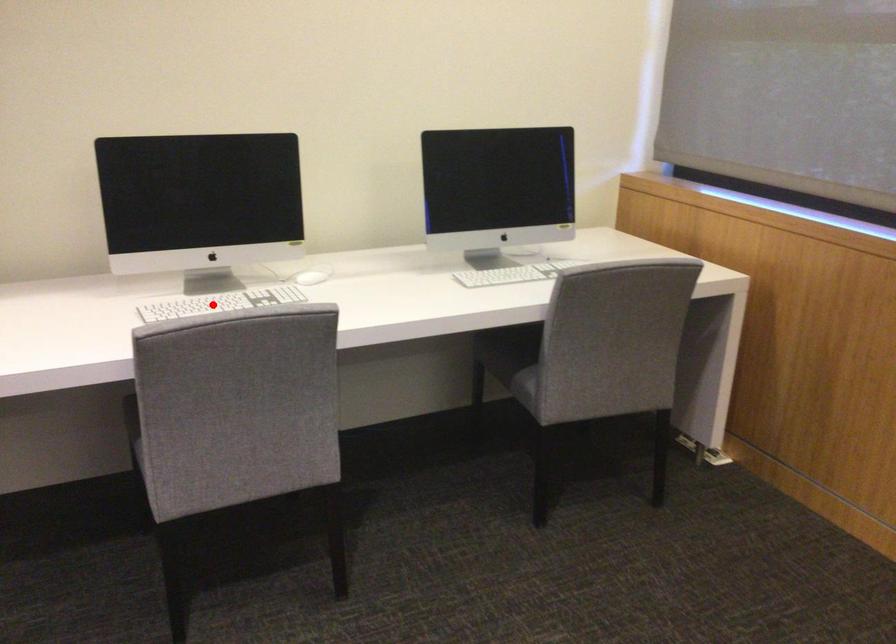
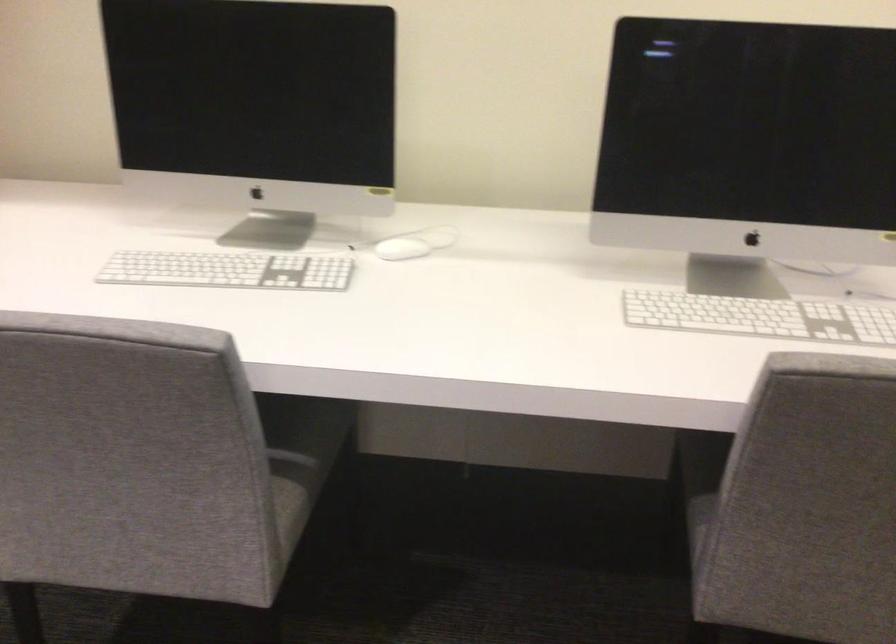
Where in the second image is the point corresponding to the highlighted location from the first image?

(228, 270)